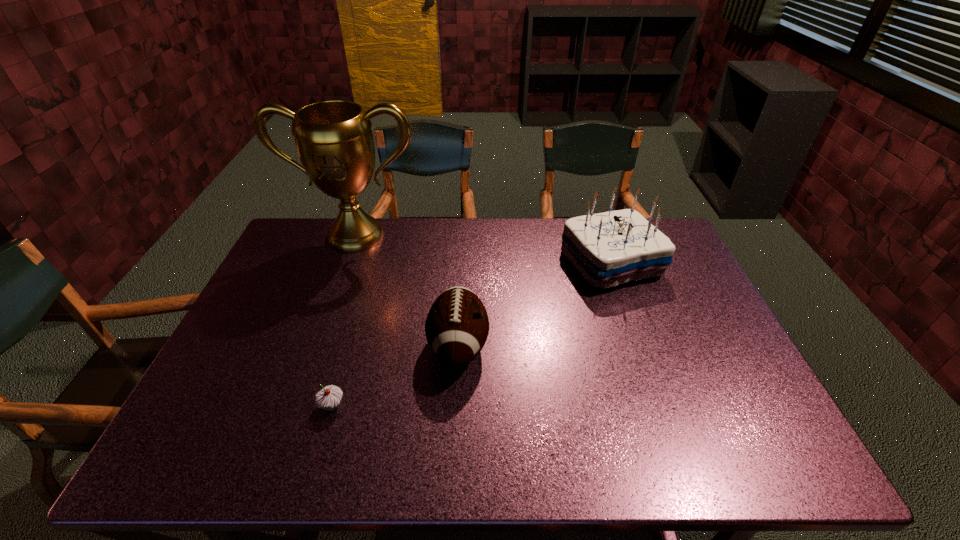
Find the location of a particular element. vacant space located 0.370m on the back of the nearest object is located at coordinates (366, 290).

At what (x,y) coordinates should I click in order to perform the action: click on trophy cup that is at the far edge. Please return your answer as a coordinate pair (x, y). Looking at the image, I should click on (334, 140).

The height and width of the screenshot is (540, 960). I want to click on birthday cake that is at the far edge, so click(610, 248).

At what (x,y) coordinates should I click in order to perform the action: click on object at the left edge. Please return your answer as a coordinate pair (x, y). The height and width of the screenshot is (540, 960). Looking at the image, I should click on (334, 140).

Where is `object located in the right edge section of the desktop`? The height and width of the screenshot is (540, 960). object located in the right edge section of the desktop is located at coordinates (610, 248).

This screenshot has width=960, height=540. I want to click on object present at the far left corner, so click(x=334, y=140).

At what (x,y) coordinates should I click in order to perform the action: click on object that is at the far right corner. Please return your answer as a coordinate pair (x, y). This screenshot has height=540, width=960. Looking at the image, I should click on (610, 248).

This screenshot has height=540, width=960. Find the location of `vacant space at the far edge`. vacant space at the far edge is located at coordinates (467, 228).

The width and height of the screenshot is (960, 540). I want to click on blank space at the near edge of the desktop, so click(609, 468).

Identify the location of vacant space at the left edge of the desktop. The height and width of the screenshot is (540, 960). click(x=263, y=293).